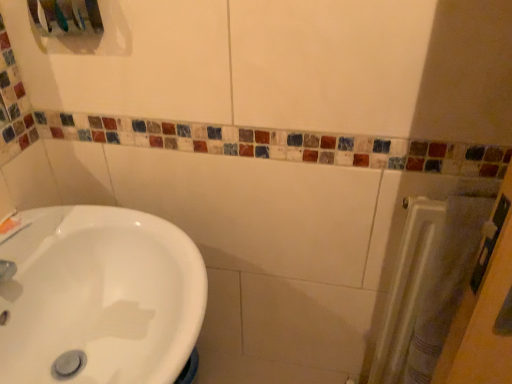
I want to click on white glossy sink at lower left, so click(x=99, y=297).

Describe the element at coordinates (99, 297) in the screenshot. I see `white glossy sink at lower left` at that location.

Where is `white glossy sink at lower left`? This screenshot has height=384, width=512. white glossy sink at lower left is located at coordinates (99, 297).